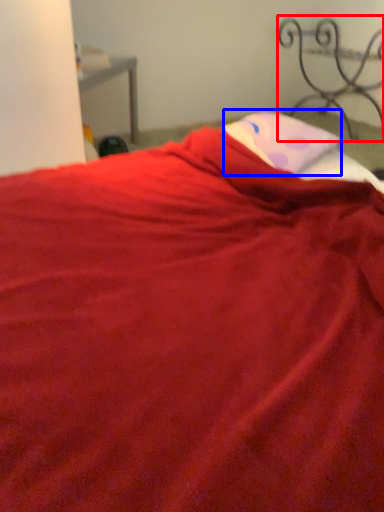
Question: Which of the following is the closest to the observer, furniture (highlighted by a red box) or pillow (highlighted by a blue box)?

Choices:
 (A) furniture
 (B) pillow

Answer: (B)